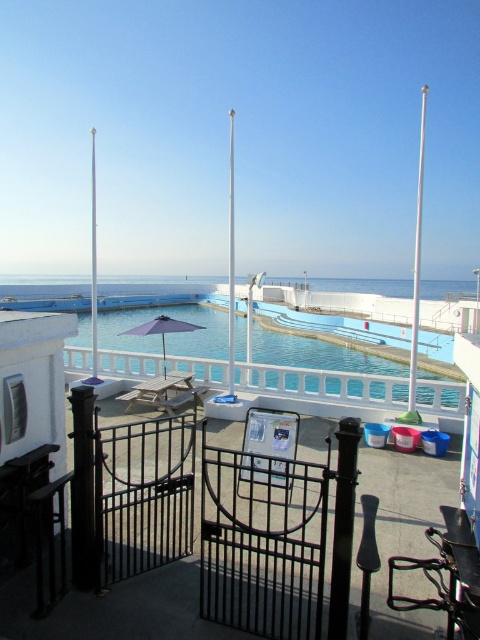
You are standing at the entrance of the pool area and want to take a photo that includes both the point at coordinates point (x=296, y=371) and the point at coordinates point (x=228, y=332). Which point will appear larger in your photo?

Point (x=296, y=371) is closer to the camera than point (x=228, y=332), so it will appear larger in the photo.